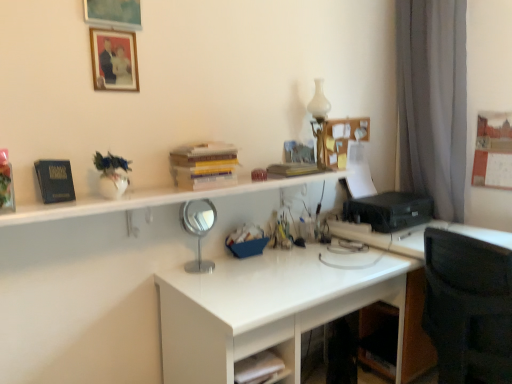
Question: Is hardcover books at upper center, the 2th book when ordered from front to back, further to the viewer compared to white glossy vase at upper right?

Choices:
 (A) yes
 (B) no

Answer: (B)

Question: Does hardcover books at upper center, the 2th book when ordered from front to back, appear on the left side of white glossy vase at upper right?

Choices:
 (A) no
 (B) yes

Answer: (B)

Question: Is hardcover books at upper center, marked as the second book in a back-to-front arrangement, smaller than white glossy vase at upper right?

Choices:
 (A) yes
 (B) no

Answer: (B)

Question: Is hardcover books at upper center, marked as the second book in a back-to-front arrangement, taller than white glossy vase at upper right?

Choices:
 (A) no
 (B) yes

Answer: (A)

Question: From a real-world perspective, does hardcover books at upper center, arranged as the second book when viewed from the right, stand above white glossy vase at upper right?

Choices:
 (A) yes
 (B) no

Answer: (B)

Question: Considering the positions of black plastic printer at right and hardcover book at upper center, which appears as the 1th book when viewed from the right, in the image, is black plastic printer at right wider or thinner than hardcover book at upper center, which appears as the 1th book when viewed from the right,?

Choices:
 (A) thin
 (B) wide

Answer: (B)

Question: From their relative heights in the image, would you say black plastic printer at right is taller or shorter than hardcover book at upper center, arranged as the third book when viewed from the left?

Choices:
 (A) tall
 (B) short

Answer: (A)

Question: In the image, is black plastic printer at right positioned in front of or behind hardcover book at upper center, arranged as the 3th book when viewed from the front?

Choices:
 (A) front
 (B) behind

Answer: (B)

Question: From the image's perspective, is black plastic printer at right positioned above or below hardcover book at upper center, arranged as the 3th book when viewed from the front?

Choices:
 (A) below
 (B) above

Answer: (A)

Question: Is hardcover books at upper center, arranged as the second book when viewed from the right, bigger or smaller than matte wooden picture frame at upper center, the first picture frame from the bottom?

Choices:
 (A) small
 (B) big

Answer: (B)

Question: From their relative heights in the image, would you say hardcover books at upper center, the 2th book when ordered from front to back, is taller or shorter than matte wooden picture frame at upper center, which is the 2th picture frame from top to bottom?

Choices:
 (A) tall
 (B) short

Answer: (B)

Question: Considering the relative positions of hardcover books at upper center, arranged as the second book when viewed from the right, and matte wooden picture frame at upper center, the first picture frame from the bottom, in the image provided, is hardcover books at upper center, arranged as the second book when viewed from the right, to the left or to the right of matte wooden picture frame at upper center, the first picture frame from the bottom,?

Choices:
 (A) right
 (B) left

Answer: (A)

Question: Which is correct: hardcover books at upper center, the 2th book when ordered from front to back, is inside matte wooden picture frame at upper center, which is the 2th picture frame from top to bottom, or outside of it?

Choices:
 (A) outside
 (B) inside

Answer: (A)

Question: In the image, is black plastic printer at right positioned in front of or behind white matte drawer at lower center?

Choices:
 (A) front
 (B) behind

Answer: (B)

Question: Is black plastic printer at right inside the boundaries of white matte drawer at lower center, or outside?

Choices:
 (A) inside
 (B) outside

Answer: (B)